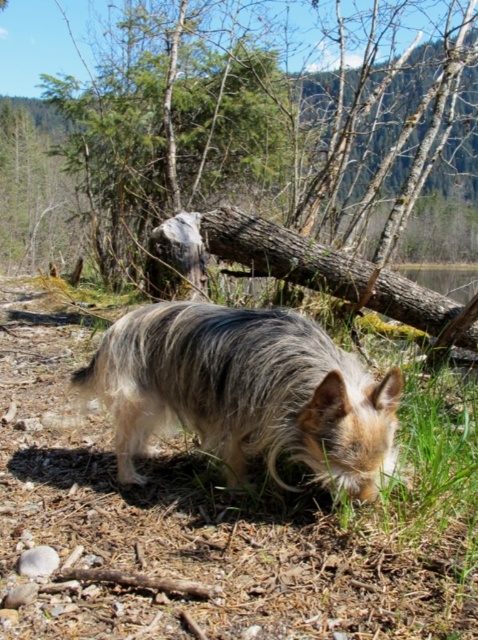
Is green mossy log at center taller than fuzzy fur dog at center?

No, green mossy log at center is not taller than fuzzy fur dog at center.

The height and width of the screenshot is (640, 478). I want to click on green mossy log at center, so click(243, 124).

The image size is (478, 640). In order to click on green mossy log at center in this screenshot , I will do 243,124.